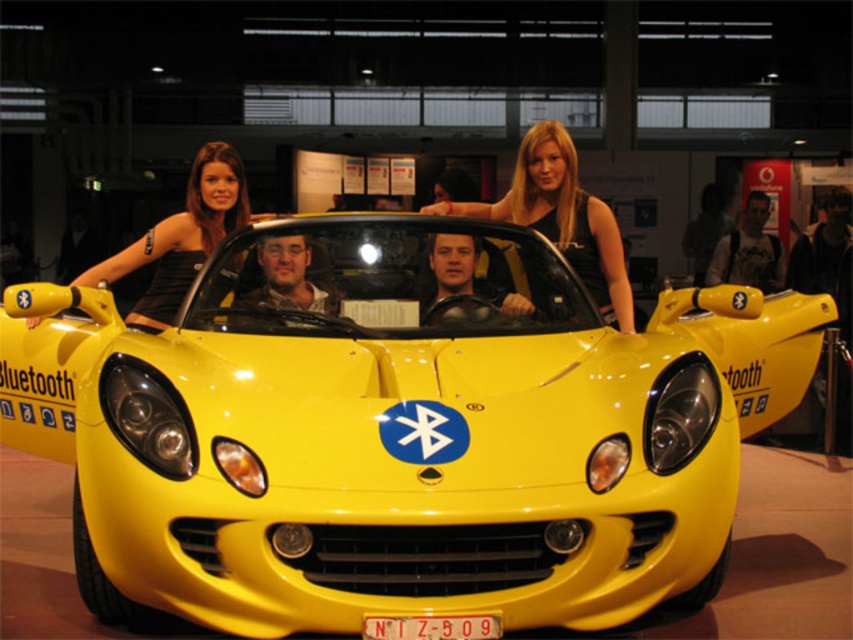
Question: Which point is farther from the camera taking this photo?

Choices:
 (A) (474, 620)
 (B) (564, 240)
 (C) (167, 284)

Answer: (B)

Question: Can you confirm if black fabric top at upper center is positioned below black satin dress at upper left?

Choices:
 (A) yes
 (B) no

Answer: (B)

Question: Which point is closer to the camera?

Choices:
 (A) (445, 616)
 (B) (285, 476)
 (C) (221, 228)
 (D) (492, 214)

Answer: (A)

Question: In this image, where is black satin dress at upper left located relative to yellow plastic license plate at center?

Choices:
 (A) left
 (B) right

Answer: (A)

Question: Can you confirm if black satin dress at upper left is wider than yellow plastic license plate at center?

Choices:
 (A) yes
 (B) no

Answer: (B)

Question: Which object is the closest to the black satin dress at upper left?

Choices:
 (A) yellow matte sports car at center
 (B) yellow plastic license plate at center
 (C) black fabric top at upper center

Answer: (A)